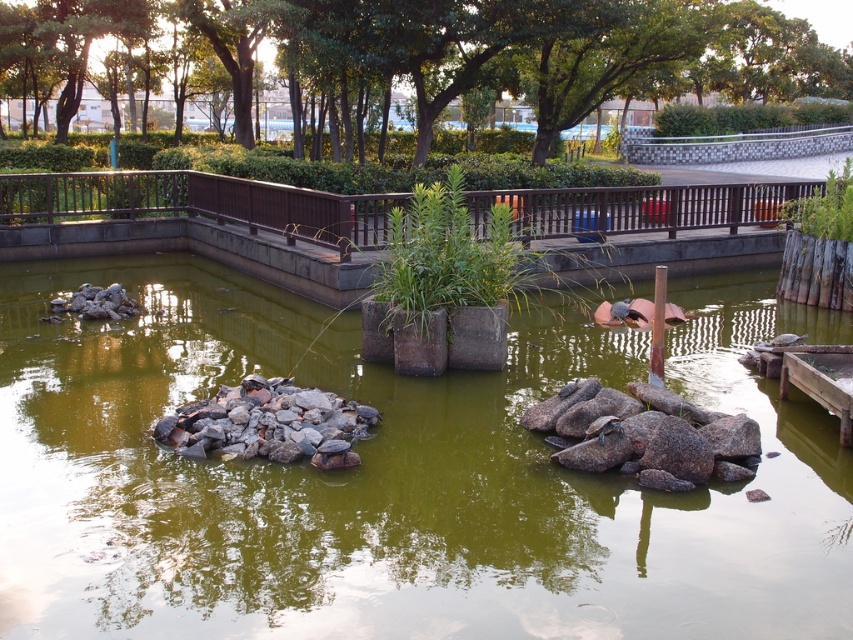
Is brown rough rock at center wider than gray rock at center?

No.

Is brown rough rock at center positioned in front of gray rock at center?

Yes, it is in front of gray rock at center.

I want to click on brown rough rock at center, so click(648, 435).

Does point (355, 428) lie behind point (120, 300)?

No, (355, 428) is closer to viewer.

Image resolution: width=853 pixels, height=640 pixels. In order to click on gray rock at center in this screenshot , I will do `click(270, 422)`.

Is brown rough rock at center positioned before gray rock at left?

That is True.

Who is more forward, [689,448] or [86,294]?

Point [689,448] is in front.

Is point (717, 445) closer to camera compared to point (67, 305)?

Yes, point (717, 445) is in front of point (67, 305).

I want to click on brown rough rock at center, so pos(648,435).